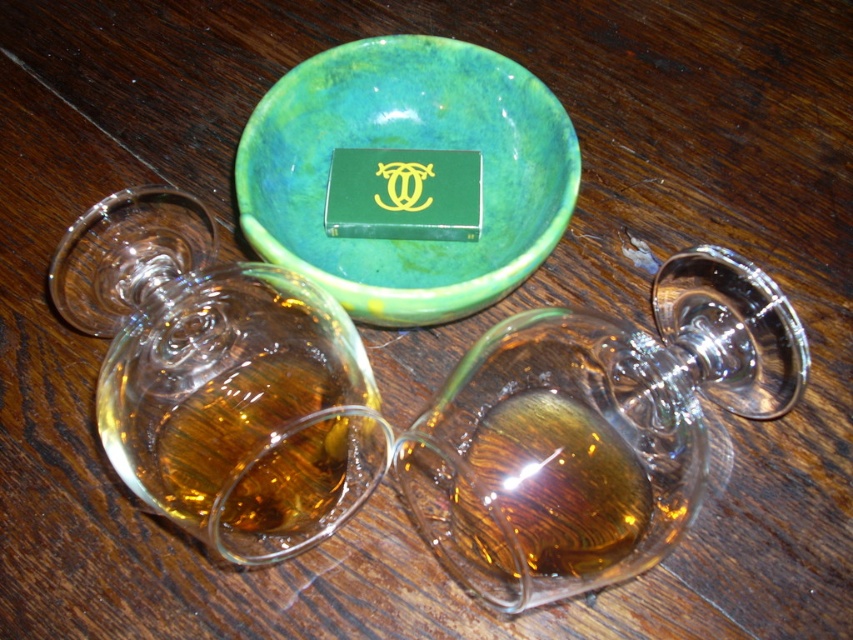
Question: Is transparent glass wine glass at center to the left of green marbled bowl at center from the viewer's perspective?

Choices:
 (A) yes
 (B) no

Answer: (B)

Question: Among these objects, which one is farthest from the camera?

Choices:
 (A) transparent glass wine glass at center
 (B) green marbled bowl at center

Answer: (B)

Question: From the image, what is the correct spatial relationship of transparent glass wine glass at center in relation to green marbled bowl at center?

Choices:
 (A) right
 (B) left

Answer: (A)

Question: Which object appears closest to the camera in this image?

Choices:
 (A) green marbled bowl at center
 (B) transparent glass wine glass at center

Answer: (B)

Question: Does transparent glass wine glass at center appear over green marbled bowl at center?

Choices:
 (A) no
 (B) yes

Answer: (A)

Question: Which point is closer to the camera taking this photo?

Choices:
 (A) (413, 77)
 (B) (454, 461)

Answer: (B)